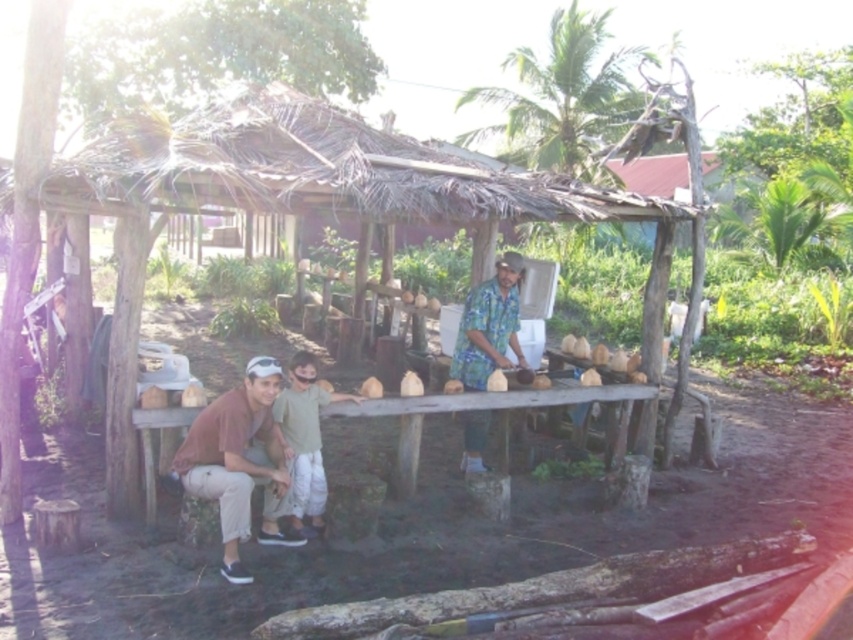
You are a photographer trying to capture the brown cotton shirt at lower left in the scene. What are the coordinates where you should focus your camera?

The coordinates to focus on are point [241,461].

You are standing in front of the coconut processing area and need to reach both the point at coordinates point (485,364) and point (316,426). Which point is closer to you?

Point (316,426) is closer to you because it is less further away than point (485,364).